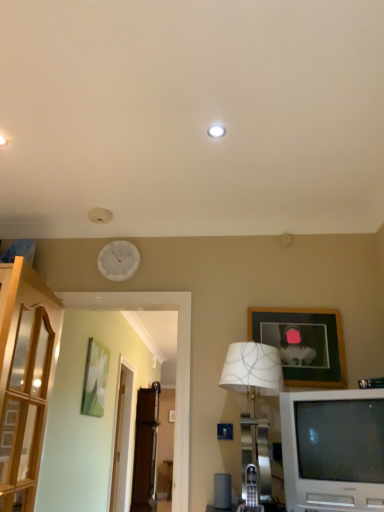
Image resolution: width=384 pixels, height=512 pixels. Identify the location of white fabric lampshade at lower right. (254, 403).

What do you see at coordinates (25, 410) in the screenshot? The image size is (384, 512). I see `clear glass door at left, the first glass door from the front` at bounding box center [25, 410].

Identify the location of white plastic television at lower right. (333, 449).

The width and height of the screenshot is (384, 512). What do you see at coordinates (122, 438) in the screenshot? I see `transparent glass door at center, the 2th glass door from the front` at bounding box center [122, 438].

In order to face wooden picture frame at upper right, the first picture frame viewed from the right, should I rotate leftwards or rightwards?

You should rotate right by 13.979 degrees.

Locate an element on the screen. wooden picture frame at upper right, which is the 1th picture frame in top-to-bottom order is located at coordinates (303, 344).

Identify the location of white fabric lampshade at lower right. (254, 403).

From a real-world perspective, which is physically below, wooden picture frame at upper right, positioned as the second picture frame in back-to-front order, or white glossy clock at upper center?

wooden picture frame at upper right, positioned as the second picture frame in back-to-front order.

Consider the image. Is white glossy clock at upper center completely or partially inside wooden picture frame at upper right, positioned as the 2th picture frame in bottom-to-top order?

That's incorrect, white glossy clock at upper center is not inside wooden picture frame at upper right, positioned as the 2th picture frame in bottom-to-top order.

Which object is wider, wooden picture frame at upper right, which is the 1th picture frame in top-to-bottom order, or white glossy clock at upper center?

wooden picture frame at upper right, which is the 1th picture frame in top-to-bottom order.

Locate an element on the screen. picture frame in front of the white glossy clock at upper center is located at coordinates (303, 344).

Is white fabric lampshade at lower right turned away from transparent glass door at center, the first glass door when ordered from bottom to top?

That's right, white fabric lampshade at lower right is facing away from transparent glass door at center, the first glass door when ordered from bottom to top.

In the image, is white fabric lampshade at lower right on the left side or the right side of transparent glass door at center, which appears as the 2th glass door when viewed from the top?

From the image, it's evident that white fabric lampshade at lower right is to the right of transparent glass door at center, which appears as the 2th glass door when viewed from the top.

Is point (246, 342) positioned in front of point (125, 461)?

Yes, point (246, 342) is in front of point (125, 461).

From a real-world perspective, between white fabric lampshade at lower right and transparent glass door at center, the 2th glass door from the front, who is vertically higher?

In real-world perspective, white fabric lampshade at lower right is above.

Considering the sizes of objects green matte painting at left, which ranks as the first picture frame in left-to-right order, and wooden picture frame at upper right, which is counted as the first picture frame, starting from the front, in the image provided, who is taller, green matte painting at left, which ranks as the first picture frame in left-to-right order, or wooden picture frame at upper right, which is counted as the first picture frame, starting from the front,?

Standing taller between the two is green matte painting at left, which ranks as the first picture frame in left-to-right order.

From a real-world perspective, who is located lower, green matte painting at left, acting as the second picture frame starting from the right, or wooden picture frame at upper right, positioned as the second picture frame in back-to-front order?

From a 3D spatial view, green matte painting at left, acting as the second picture frame starting from the right, is below.

In the image, is green matte painting at left, placed as the 2th picture frame when sorted from top to bottom, on the left side or the right side of wooden picture frame at upper right, which is the second picture frame from left to right?

green matte painting at left, placed as the 2th picture frame when sorted from top to bottom, is to the left of wooden picture frame at upper right, which is the second picture frame from left to right.

From the image's perspective, is green matte painting at left, placed as the 2th picture frame when sorted from top to bottom, over wooden picture frame at upper right, which is counted as the first picture frame, starting from the front?

No, from the image's perspective, green matte painting at left, placed as the 2th picture frame when sorted from top to bottom, is not over wooden picture frame at upper right, which is counted as the first picture frame, starting from the front.

At what (x,y) coordinates should I click in order to perform the action: click on television below the white glossy clock at upper center (from the image's perspective). Please return your answer as a coordinate pair (x, y). Looking at the image, I should click on (333, 449).

Considering the relative positions of white plastic television at lower right and white glossy clock at upper center in the image provided, is white plastic television at lower right in front of white glossy clock at upper center?

Yes, it is.

Is white plastic television at lower right completely or partially outside of white glossy clock at upper center?

Yes, white plastic television at lower right is not within white glossy clock at upper center.

From the image's perspective, is white plastic television at lower right located above or below white glossy clock at upper center?

white plastic television at lower right is below white glossy clock at upper center.

Is transparent glass door at center, which is counted as the first glass door, starting from the back, thinner than wooden picture frame at upper right, positioned as the 2th picture frame in bottom-to-top order?

Incorrect, the width of transparent glass door at center, which is counted as the first glass door, starting from the back, is not less than that of wooden picture frame at upper right, positioned as the 2th picture frame in bottom-to-top order.

Considering the relative positions of transparent glass door at center, the first glass door when ordered from bottom to top, and wooden picture frame at upper right, which is counted as the first picture frame, starting from the front, in the image provided, is transparent glass door at center, the first glass door when ordered from bottom to top, to the left of wooden picture frame at upper right, which is counted as the first picture frame, starting from the front, from the viewer's perspective?

Yes, transparent glass door at center, the first glass door when ordered from bottom to top, is to the left of wooden picture frame at upper right, which is counted as the first picture frame, starting from the front.

In the scene shown: From the image's perspective, is transparent glass door at center, the first glass door when ordered from bottom to top, located beneath wooden picture frame at upper right, which is the 1th picture frame in top-to-bottom order?

Yes.

Is point (128, 437) positioned after point (294, 344)?

That is True.

Is white fabric lampshade at lower right positioned before white glossy clock at upper center?

Yes, it is in front of white glossy clock at upper center.

Looking at this image, is white fabric lampshade at lower right facing towards white glossy clock at upper center?

No, white fabric lampshade at lower right is not turned towards white glossy clock at upper center.

From the image's perspective, which one is positioned lower, white fabric lampshade at lower right or white glossy clock at upper center?

white fabric lampshade at lower right, from the image's perspective.

Are white fabric lampshade at lower right and white glossy clock at upper center making contact?

No, white fabric lampshade at lower right is not touching white glossy clock at upper center.

Can you confirm if white glossy clock at upper center is smaller than white plastic television at lower right?

Yes, white glossy clock at upper center is smaller than white plastic television at lower right.

Which object is positioned more to the right, white glossy clock at upper center or white plastic television at lower right?

white plastic television at lower right is more to the right.

Which of these two, white glossy clock at upper center or white plastic television at lower right, stands shorter?

With less height is white glossy clock at upper center.

Do you think white glossy clock at upper center is within white plastic television at lower right, or outside of it?

white glossy clock at upper center is not inside white plastic television at lower right, it's outside.

Find the location of a particular element. Image resolution: width=384 pixels, height=512 pixels. the 1st picture frame positioned below the white glossy clock at upper center (from the image's perspective) is located at coordinates (303, 344).

Locate an element on the screen. The height and width of the screenshot is (512, 384). lamp above the transparent glass door at center, which appears as the 2th glass door when viewed from the top (from the image's perspective) is located at coordinates (254, 403).

Which object lies nearer to the anchor point white fabric lampshade at lower right, clear glass door at left, the first glass door from the front, or wooden picture frame at upper right, positioned as the second picture frame in back-to-front order?

wooden picture frame at upper right, positioned as the second picture frame in back-to-front order.

Estimate the real-world distances between objects in this image. Which object is further from green matte painting at left, positioned as the first picture frame in bottom-to-top order, white plastic television at lower right or wooden picture frame at upper right, which is counted as the first picture frame, starting from the front?

white plastic television at lower right is positioned further to the anchor green matte painting at left, positioned as the first picture frame in bottom-to-top order.

Which object lies further to the anchor point green matte painting at left, acting as the second picture frame starting from the right, clear glass door at left, marked as the second glass door in a bottom-to-top arrangement, or white fabric lampshade at lower right?

white fabric lampshade at lower right.

Looking at the image, which one is located further to white glossy clock at upper center, white plastic television at lower right or white fabric lampshade at lower right?

The object further to white glossy clock at upper center is white plastic television at lower right.

From the image, which object appears to be nearer to white glossy clock at upper center, white fabric lampshade at lower right or wooden picture frame at upper right, which is counted as the first picture frame, starting from the front?

Among the two, white fabric lampshade at lower right is located nearer to white glossy clock at upper center.

When comparing their distances from transparent glass door at center, which is counted as the first glass door, starting from the back, does white plastic television at lower right or wooden picture frame at upper right, which is counted as the first picture frame, starting from the front, seem further?

white plastic television at lower right is positioned further to the anchor transparent glass door at center, which is counted as the first glass door, starting from the back.

Looking at the image, which one is located further to green matte painting at left, the first picture frame positioned from the back, white glossy clock at upper center or white plastic television at lower right?

Among the two, white plastic television at lower right is located further to green matte painting at left, the first picture frame positioned from the back.

Estimate the real-world distances between objects in this image. Which object is further from clear glass door at left, the 1th glass door in the top-to-bottom sequence, white glossy clock at upper center or white plastic television at lower right?

The object further to clear glass door at left, the 1th glass door in the top-to-bottom sequence, is white plastic television at lower right.

Locate an element on the screen. lamp positioned between clear glass door at left, the 1th glass door in the top-to-bottom sequence, and green matte painting at left, placed as the 2th picture frame when sorted from top to bottom, from near to far is located at coordinates (254, 403).

Where is `picture frame between clear glass door at left, marked as the second glass door in a bottom-to-top arrangement, and green matte painting at left, acting as the second picture frame starting from the right, along the z-axis`? Image resolution: width=384 pixels, height=512 pixels. picture frame between clear glass door at left, marked as the second glass door in a bottom-to-top arrangement, and green matte painting at left, acting as the second picture frame starting from the right, along the z-axis is located at coordinates (303, 344).

The image size is (384, 512). Find the location of `television between clear glass door at left, the first glass door from the front, and transparent glass door at center, the first glass door when ordered from bottom to top, along the z-axis`. television between clear glass door at left, the first glass door from the front, and transparent glass door at center, the first glass door when ordered from bottom to top, along the z-axis is located at coordinates (333, 449).

Find the location of a particular element. lamp between clear glass door at left, the second glass door positioned from the back, and white plastic television at lower right from left to right is located at coordinates (254, 403).